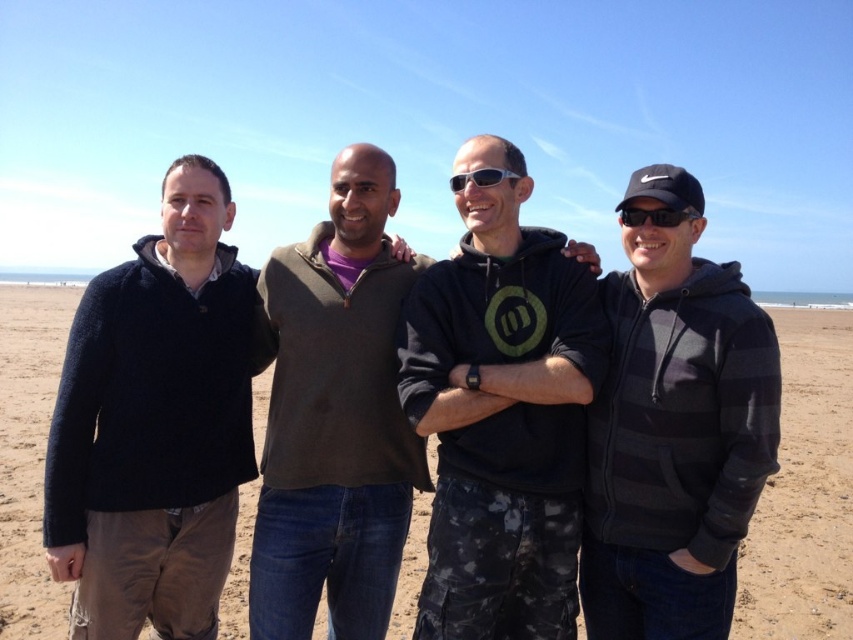
What is the color of the sweater worn by the person standing at the position corresponding to the coordinates point (155, 422)?

The sweater at point (155, 422) is dark blue.

You are a photographer trying to capture a group photo of the sandy beach at lower center and the dark gray sweater at center. Which object in the scene is bigger?

The sandy beach at lower center is larger in size than the dark gray sweater at center.